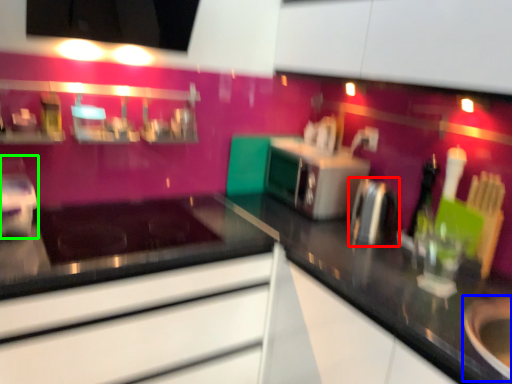
Question: Based on their relative distances, which object is farther from appliance (highlighted by a red box)? Choose from appliance (highlighted by a blue box) and appliance (highlighted by a green box).

Choices:
 (A) appliance
 (B) appliance

Answer: (B)